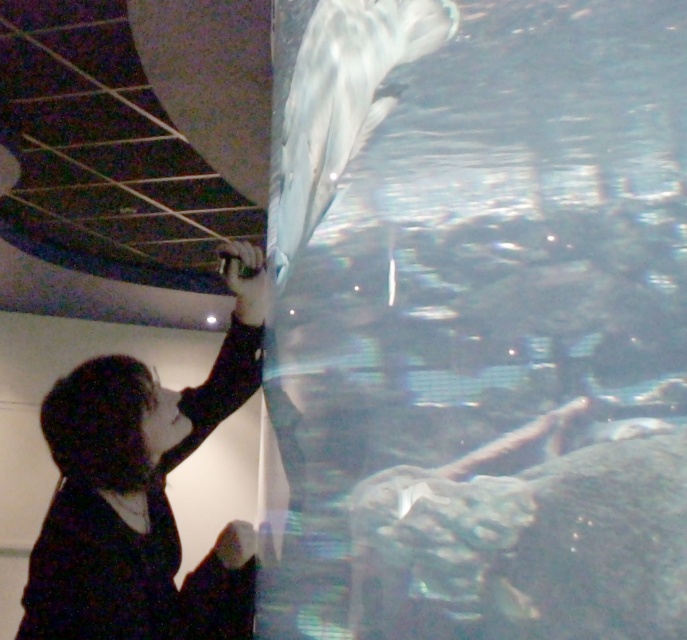
You are a visitor at the aquarium and want to take a photo of the white glossy dolphin at upper center without the black matte jacket at lower left appearing in the frame. Which direction should you move to achieve this?

The black matte jacket at lower left is to the left of the white glossy dolphin at upper center. To avoid the jacket in your photo, move to the right side so that the jacket moves out of the frame to the left while keeping the dolphin centered.

You are a visitor at the aquarium and want to take a photo of the white glossy dolphin at upper center without the black matte jacket at lower left appearing in the frame. Is it possible to do so by moving closer to the dolphin?

The black matte jacket at lower left is bigger than the white glossy dolphin at upper center, which means the jacket is closer to the camera. Moving closer to the dolphin might not eliminate the jacket from the frame since it is closer and larger in the image.

You are standing in front of the aquarium tank and notice two points marked on the glass. The first point is at coordinate point (58, 456) and the second is at point (409, 8). If you want to touch the point that is closer to you, which coordinate should you aim for?

The point at coordinate point (58, 456) is further to the viewer than point (409, 8). Wait, the description says the opposite. Let me check again. The Objects Description states that point (58, 456) is further to the viewer than point (409, 8). So the closer point would be point (409, 8). Therefore, the answer should be that point (409, 8) is closer. Hmm, but the user wants to touch the point closer to them. Since point A is further away, point B is closer. So the answer is point 0.014